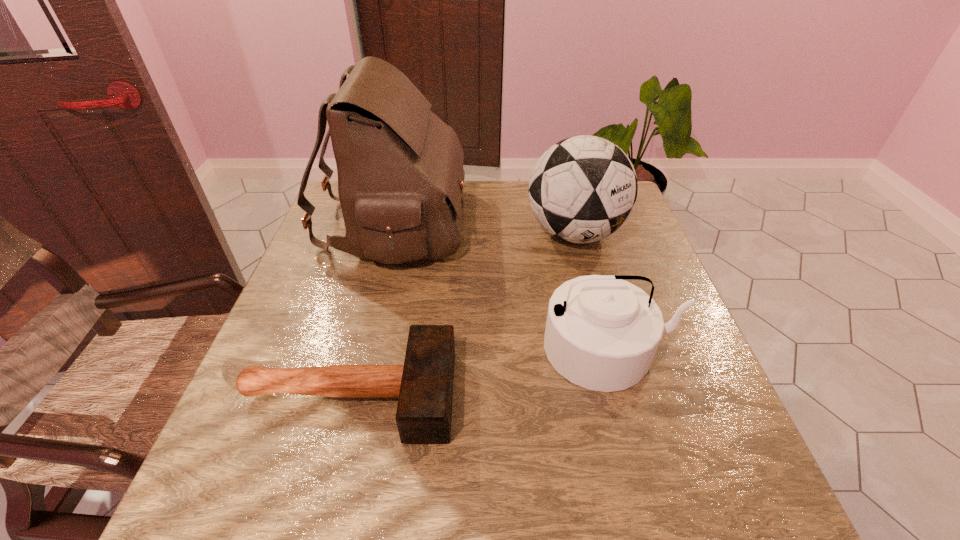
Image resolution: width=960 pixels, height=540 pixels. In order to click on satchel that is at the left edge in this screenshot , I will do `click(400, 170)`.

This screenshot has height=540, width=960. Find the location of `mallet present at the left edge`. mallet present at the left edge is located at coordinates (424, 384).

Find the location of `soccer ball located at the right edge`. soccer ball located at the right edge is located at coordinates (582, 189).

Where is `kettle that is at the right edge`? This screenshot has width=960, height=540. kettle that is at the right edge is located at coordinates (602, 333).

Identify the location of object situated at the far left corner. Image resolution: width=960 pixels, height=540 pixels. (400, 170).

Where is `object present at the far right corner`? This screenshot has height=540, width=960. object present at the far right corner is located at coordinates (582, 189).

Where is `vacant space at the far edge of the desktop`? This screenshot has height=540, width=960. vacant space at the far edge of the desktop is located at coordinates click(481, 204).

This screenshot has height=540, width=960. Identify the location of vacant space at the near edge of the desktop. (297, 510).

You are a GUI agent. You are given a task and a screenshot of the screen. Output one action in this format:
    pyautogui.click(x=<x>, y=<y>)
    Task: Click on the free space at the left edge of the desktop
    
    Given the screenshot: What is the action you would take?
    324,340

At what (x,y) coordinates should I click in order to perform the action: click on vacant region at the right edge. Please return your answer as a coordinate pair (x, y). Image resolution: width=960 pixels, height=540 pixels. Looking at the image, I should click on (632, 260).